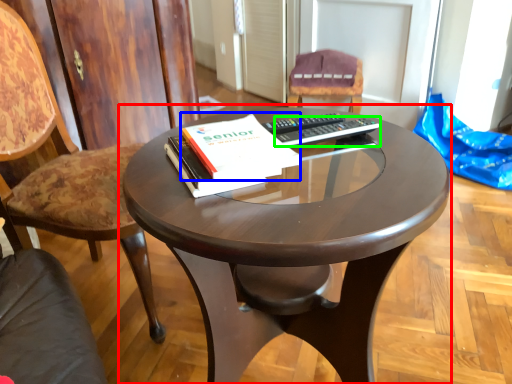
Question: Considering the real-world distances, which object is closest to coffee table (highlighted by a red box)? paperback book (highlighted by a blue box) or remote (highlighted by a green box).

Choices:
 (A) paperback book
 (B) remote

Answer: (A)